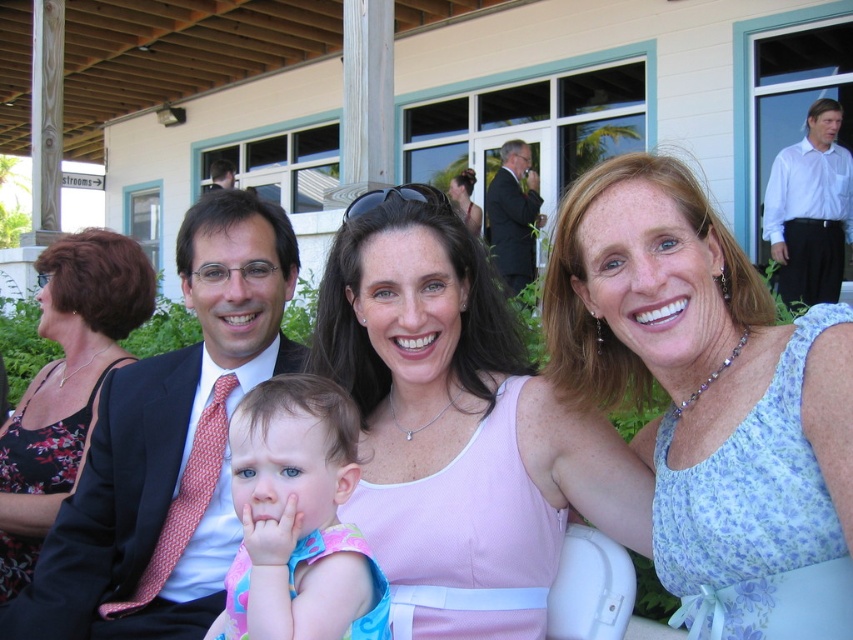
You are a photographer at a social event and need to adjust the lighting to ensure both the white shirt at upper right and the matte black suit at upper center are well lit. Considering their positions, which one might require more adjustment to avoid being too dark or too bright?

The white shirt at upper right is in front of the matte black suit at upper center. Since the white shirt is closer to the camera, it might reflect more light and could appear overexposed, so adjustments should focus on preventing overexposure there while ensuring the matte black suit at upper center is adequately lit.

You are a photographer at a social event and need to adjust your camera to focus on the pink fabric dress at center and the matte black suit at upper center. Which object is located lower in the frame?

The pink fabric dress at center is positioned under the matte black suit at upper center, so the pink fabric dress at center is lower in the frame.